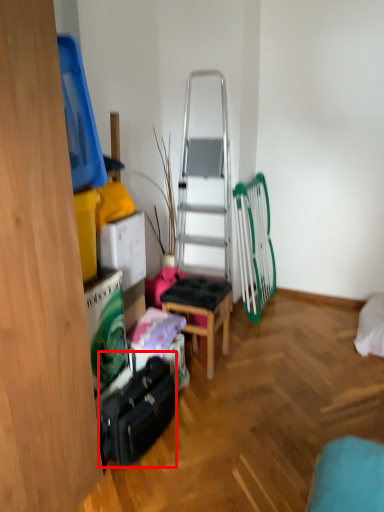
Question: From the image's perspective, where is luggage (annotated by the red box) located in relation to stool in the image?

Choices:
 (A) above
 (B) below

Answer: (B)